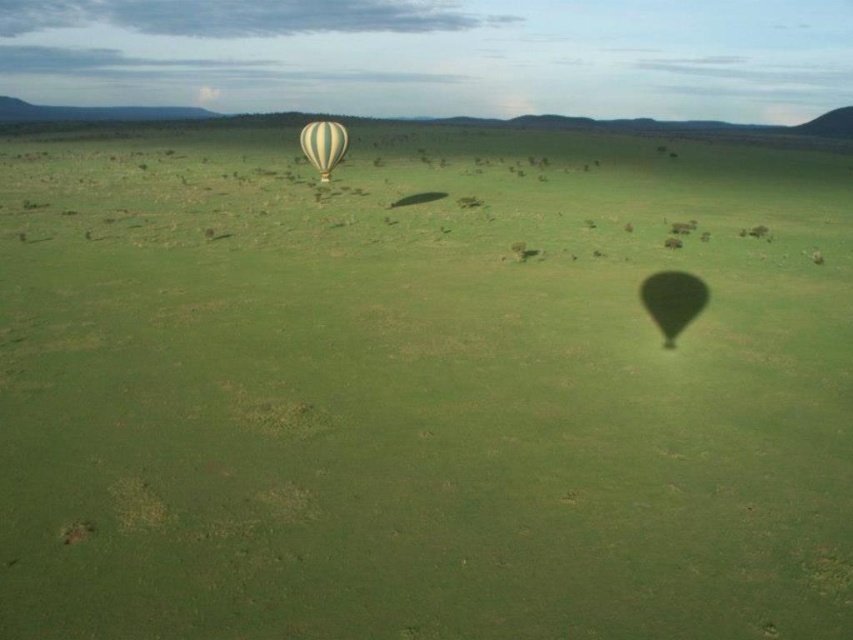
Question: Among these points, which one is nearest to the camera?

Choices:
 (A) (300, 136)
 (B) (685, 305)

Answer: (B)

Question: Does translucent yellow balloon at lower right appear over yellow striped fabric balloon at center?

Choices:
 (A) no
 (B) yes

Answer: (A)

Question: Is translucent yellow balloon at lower right below yellow striped fabric balloon at center?

Choices:
 (A) yes
 (B) no

Answer: (A)

Question: Can you confirm if translucent yellow balloon at lower right is positioned to the left of yellow striped fabric balloon at center?

Choices:
 (A) no
 (B) yes

Answer: (A)